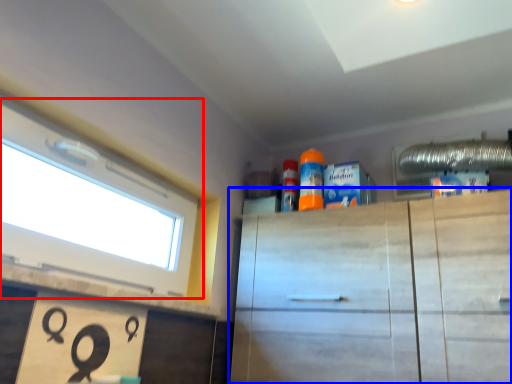
Question: Which of the following is the farthest to the observer, window (highlighted by a red box) or cabinetry (highlighted by a blue box)?

Choices:
 (A) window
 (B) cabinetry

Answer: (B)